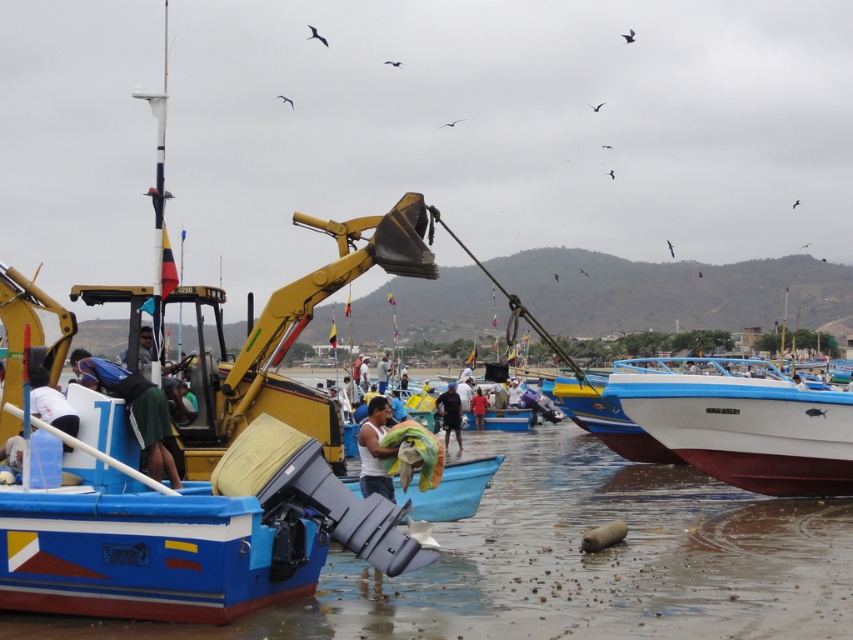
You are standing on the dock and see the black matte person at center and the light blue fabric at center in the harbor scene. Which object is positioned more to the left?

The light blue fabric at center is positioned more to the left than the black matte person at center.

You are a photographer standing at the harbor and notice a blue fabric bag at center and a white matte tank top at center. Which object would you need to zoom in more to capture details of?

The blue fabric bag at center is smaller than the white matte tank top at center, so you would need to zoom in more to capture details of the blue fabric bag at center.